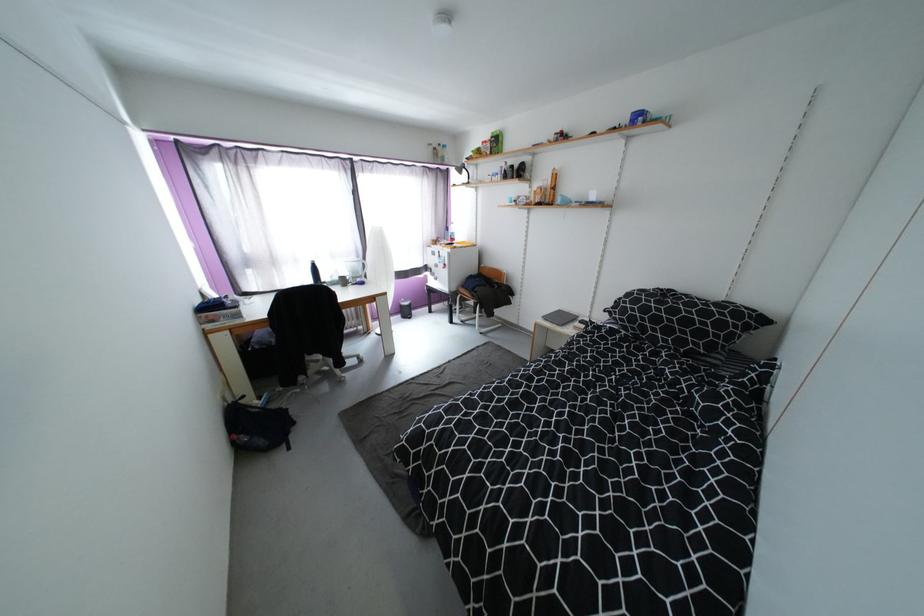
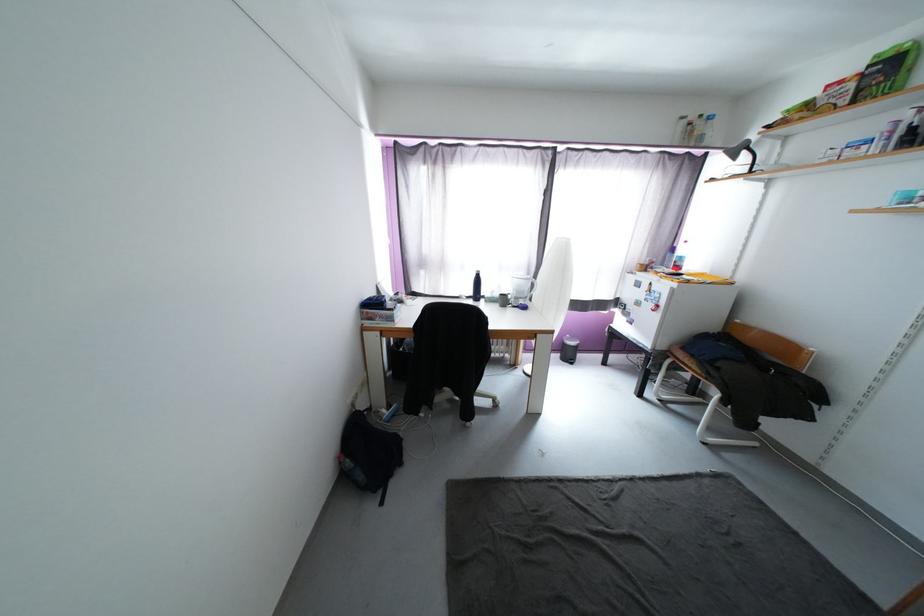
Locate, in the second image, the point that corresponds to (515,305) in the first image.

(812, 419)